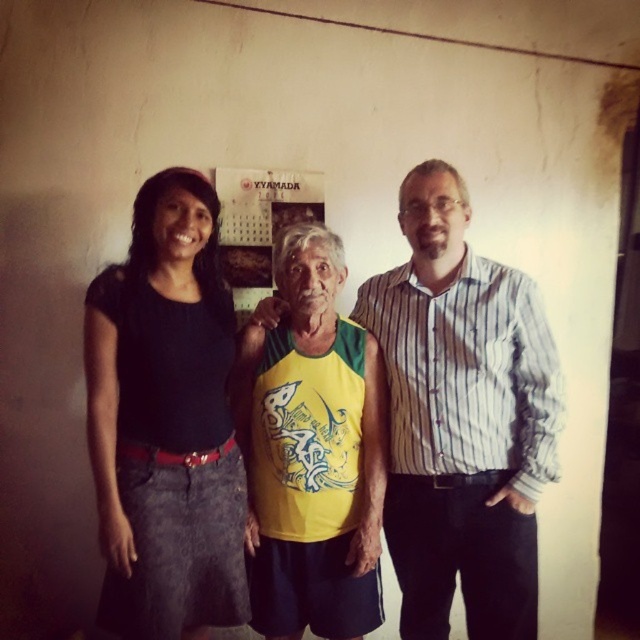
Question: Among these points, which one is farthest from the camera?

Choices:
 (A) (513, 573)
 (B) (163, 312)
 (C) (467, 392)

Answer: (C)

Question: Does yellow-green fabric shirt at center have a larger size compared to striped cotton shirt at center?

Choices:
 (A) yes
 (B) no

Answer: (A)

Question: Does striped cotton shirt at center appear on the left side of black denim skirt at left?

Choices:
 (A) no
 (B) yes

Answer: (A)

Question: Which of the following is the closest to the observer?

Choices:
 (A) striped cotton shirt at center
 (B) black denim skirt at left
 (C) yellow-green jersey at center

Answer: (B)

Question: Considering the real-world distances, which object is farthest from the yellow-green fabric shirt at center?

Choices:
 (A) yellow-green jersey at center
 (B) striped cotton shirt at center

Answer: (A)

Question: Is black denim skirt at left above yellow-green jersey at center?

Choices:
 (A) yes
 (B) no

Answer: (A)